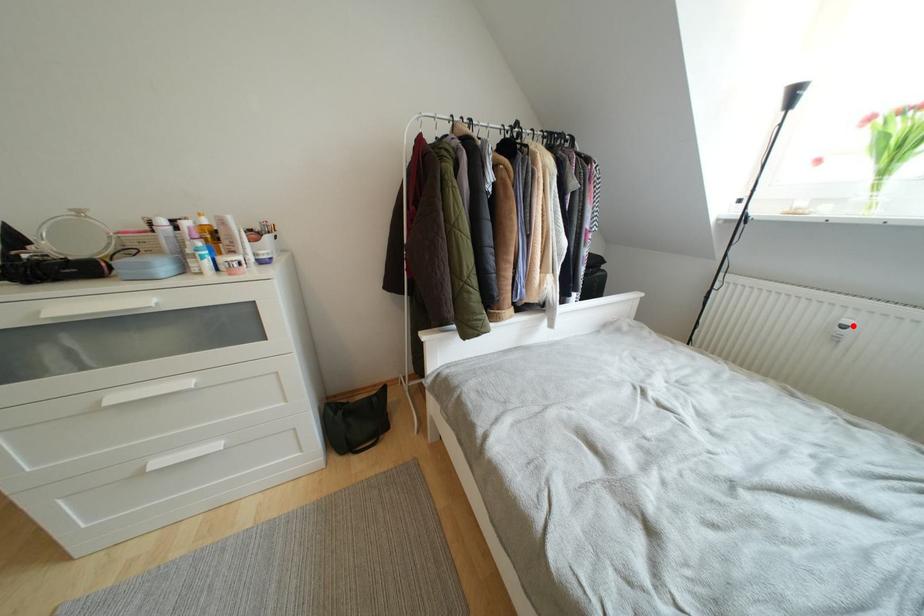
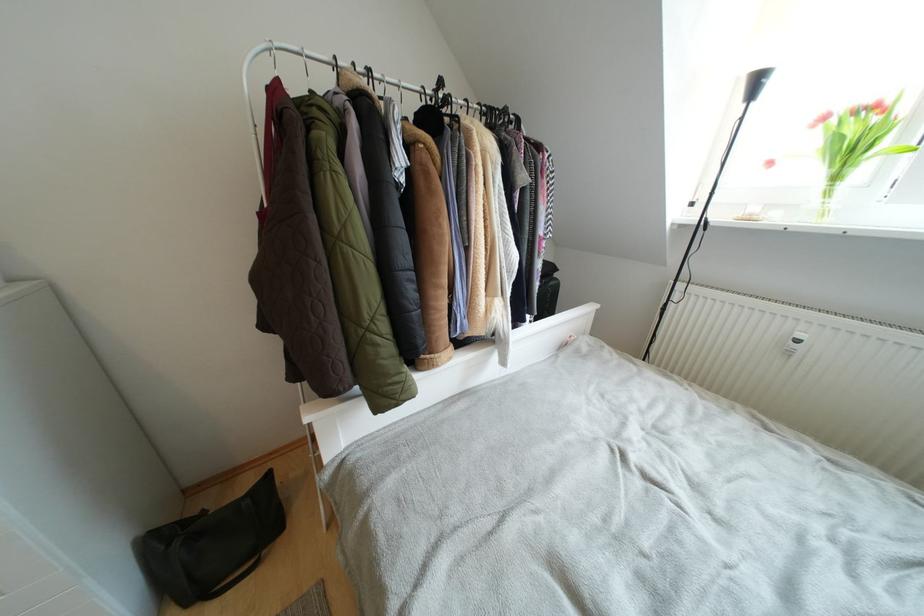
Where in the second image is the point corresponding to the highlighted location from the first image?

(805, 339)